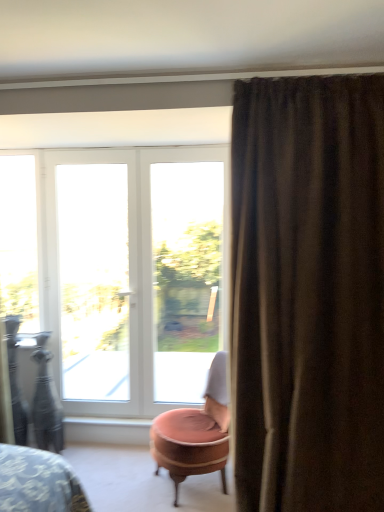
The image size is (384, 512). What do you see at coordinates (195, 433) in the screenshot?
I see `pink velvet ottoman at center` at bounding box center [195, 433].

Describe the element at coordinates (308, 293) in the screenshot. This screenshot has width=384, height=512. I see `brown textured curtain at right` at that location.

The width and height of the screenshot is (384, 512). Identify the location of brown textured curtain at right. (308, 293).

The width and height of the screenshot is (384, 512). I want to click on white glossy window sill at lower center, so click(x=107, y=422).

Where is `pink velvet ottoman at center`? pink velvet ottoman at center is located at coordinates (195, 433).

How far apart are pink velvet ottoman at center and white glass door at left, which appears as the 2th window when viewed from the left?

The distance of pink velvet ottoman at center from white glass door at left, which appears as the 2th window when viewed from the left, is 3.34 feet.

Between pink velvet ottoman at center and white glass door at left, placed as the 2th window when sorted from right to left, which one appears on the right side from the viewer's perspective?

pink velvet ottoman at center.

Locate an element on the screen. This screenshot has height=512, width=384. chair that is under the white glass door at left, placed as the 2th window when sorted from right to left (from a real-world perspective) is located at coordinates (195, 433).

Is point (169, 455) in front of point (106, 353)?

That is True.

From a real-world perspective, which is physically above, brown textured curtain at right or pink velvet ottoman at center?

brown textured curtain at right, from a real-world perspective.

Does brown textured curtain at right have a smaller size compared to pink velvet ottoman at center?

No, brown textured curtain at right is not smaller than pink velvet ottoman at center.

From the image's perspective, which object appears higher, brown textured curtain at right or pink velvet ottoman at center?

brown textured curtain at right is shown above in the image.

Is brown textured curtain at right wider than pink velvet ottoman at center?

No.

Is white plastic window at center, which is the first window from right to left, inside the boundaries of brown textured curtain at right, or outside?

white plastic window at center, which is the first window from right to left, exists outside the volume of brown textured curtain at right.

Between white plastic window at center, marked as the third window in a left-to-right arrangement, and brown textured curtain at right, which one appears on the left side from the viewer's perspective?

From the viewer's perspective, white plastic window at center, marked as the third window in a left-to-right arrangement, appears more on the left side.

Can you tell me how much white plastic window at center, which is the first window from right to left, and brown textured curtain at right differ in facing direction?

0.105 degrees.

Are white plastic window at center, which is the first window from right to left, and brown textured curtain at right far apart?

Yes, white plastic window at center, which is the first window from right to left, and brown textured curtain at right are located far from each other.

Between brown textured curtain at right and white glossy window sill at lower center, which one has less height?

Standing shorter between the two is white glossy window sill at lower center.

Which of these two, brown textured curtain at right or white glossy window sill at lower center, is smaller?

With smaller size is white glossy window sill at lower center.

From a real-world perspective, does brown textured curtain at right stand above white glossy window sill at lower center?

Correct, in the physical world, brown textured curtain at right is higher than white glossy window sill at lower center.

Is the position of brown textured curtain at right more distant than that of white glossy window sill at lower center?

No, the depth of brown textured curtain at right is less than that of white glossy window sill at lower center.

Would you say pink velvet ottoman at center is part of white glossy window sill at lower center's contents?

No.

Is white glossy window sill at lower center to the right of pink velvet ottoman at center from the viewer's perspective?

No.

Is white glossy window sill at lower center in front of pink velvet ottoman at center?

No, white glossy window sill at lower center is further to the viewer.

Is white glass door at center positioned far away from brown textured curtain at right?

Yes, white glass door at center and brown textured curtain at right are located far from each other.

Is white glass door at center taller or shorter than brown textured curtain at right?

white glass door at center is shorter than brown textured curtain at right.

Would you say white glass door at center contains brown textured curtain at right?

No, brown textured curtain at right is located outside of white glass door at center.

Considering the sizes of objects white glass door at center and brown textured curtain at right in the image provided, who is thinner, white glass door at center or brown textured curtain at right?

Thinner between the two is white glass door at center.

Which of these two, white glass door at left, which appears as the 2th window when viewed from the left, or pink velvet ottoman at center, stands taller?

With more height is white glass door at left, which appears as the 2th window when viewed from the left.

Is white glass door at left, placed as the 2th window when sorted from right to left, positioned far away from pink velvet ottoman at center?

Yes, white glass door at left, placed as the 2th window when sorted from right to left, is far from pink velvet ottoman at center.

In terms of size, does white glass door at left, which appears as the 2th window when viewed from the left, appear bigger or smaller than pink velvet ottoman at center?

white glass door at left, which appears as the 2th window when viewed from the left, is smaller than pink velvet ottoman at center.

Measure the distance between white glass door at left, which appears as the 2th window when viewed from the left, and pink velvet ottoman at center.

white glass door at left, which appears as the 2th window when viewed from the left, is 1.02 meters away from pink velvet ottoman at center.

Where is `chair in front of the white glass door at left, which appears as the 2th window when viewed from the left`? This screenshot has width=384, height=512. chair in front of the white glass door at left, which appears as the 2th window when viewed from the left is located at coordinates (195, 433).

Where is `chair that is under the brown textured curtain at right (from a real-world perspective)`? The height and width of the screenshot is (512, 384). chair that is under the brown textured curtain at right (from a real-world perspective) is located at coordinates (195, 433).

Which object lies further to the anchor point white plastic window at center, which is the first window from right to left, white glass door at left, placed as the 2th window when sorted from right to left, or white glass door at center?

white glass door at left, placed as the 2th window when sorted from right to left, lies further to white plastic window at center, which is the first window from right to left, than the other object.

Estimate the real-world distances between objects in this image. Which object is further from white glass door at center, white glass door at left, which appears as the 2th window when viewed from the left, or brown textured curtain at right?

The object further to white glass door at center is brown textured curtain at right.

From the image, which object appears to be nearer to white glossy window sill at lower center, brown textured curtain at right or clear glass window at left, the first window viewed from the left?

Among the two, clear glass window at left, the first window viewed from the left, is located nearer to white glossy window sill at lower center.

In the scene shown: Looking at the image, which one is located closer to pink velvet ottoman at center, clear glass window at left, the first window viewed from the left, or white glass door at left, which appears as the 2th window when viewed from the left?

Based on the image, white glass door at left, which appears as the 2th window when viewed from the left, appears to be nearer to pink velvet ottoman at center.

Based on their spatial positions, is pink velvet ottoman at center or brown textured curtain at right further from white glass door at left, placed as the 2th window when sorted from right to left?

brown textured curtain at right.

From the image, which object appears to be nearer to white glass door at center, white glass door at left, placed as the 2th window when sorted from right to left, or white plastic window at center, marked as the third window in a left-to-right arrangement?

Among the two, white glass door at left, placed as the 2th window when sorted from right to left, is located nearer to white glass door at center.

From the picture: Looking at the image, which one is located closer to white glass door at left, which appears as the 2th window when viewed from the left, white plastic window at center, marked as the third window in a left-to-right arrangement, or clear glass window at left, the 3th window in the right-to-left sequence?

The object closer to white glass door at left, which appears as the 2th window when viewed from the left, is clear glass window at left, the 3th window in the right-to-left sequence.

Considering their positions, is pink velvet ottoman at center positioned further to white glass door at center than white plastic window at center, which is the first window from right to left?

The object further to white glass door at center is pink velvet ottoman at center.

Locate an element on the screen. door between white glass door at left, which appears as the 2th window when viewed from the left, and white plastic window at center, which is the first window from right to left, in the horizontal direction is located at coordinates (136, 275).

Find the location of `chair between white glass door at left, placed as the 2th window when sorted from right to left, and white glossy window sill at lower center vertically`. chair between white glass door at left, placed as the 2th window when sorted from right to left, and white glossy window sill at lower center vertically is located at coordinates (195, 433).

Where is `door located between clear glass window at left, the 3th window in the right-to-left sequence, and brown textured curtain at right in the left-right direction`? The height and width of the screenshot is (512, 384). door located between clear glass window at left, the 3th window in the right-to-left sequence, and brown textured curtain at right in the left-right direction is located at coordinates (136, 275).

Find the location of `door located between brown textured curtain at right and white glass door at left, placed as the 2th window when sorted from right to left, in the depth direction`. door located between brown textured curtain at right and white glass door at left, placed as the 2th window when sorted from right to left, in the depth direction is located at coordinates (136, 275).